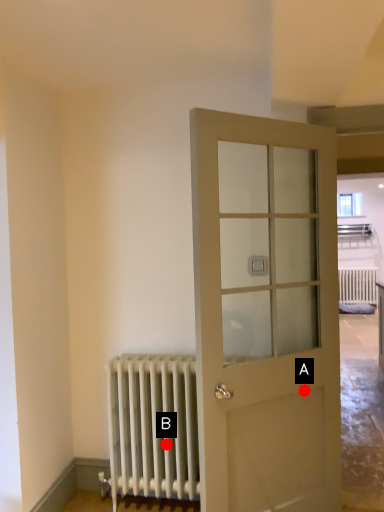
Question: Two points are circled on the image, labeled by A and B beside each circle. Which point appears closest to the camera in this image?

Choices:
 (A) A is closer
 (B) B is closer

Answer: (A)